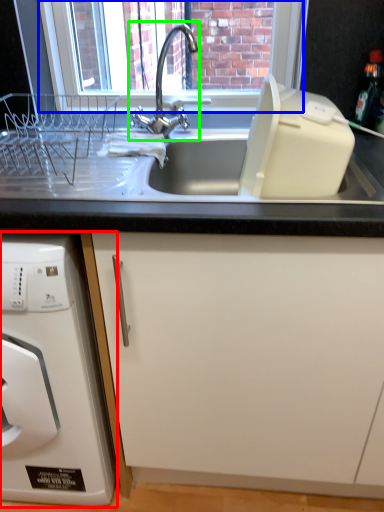
Question: Which is nearer to the home appliance (highlighted by a red box)? window screen (highlighted by a blue box) or tap (highlighted by a green box).

Choices:
 (A) window screen
 (B) tap

Answer: (B)